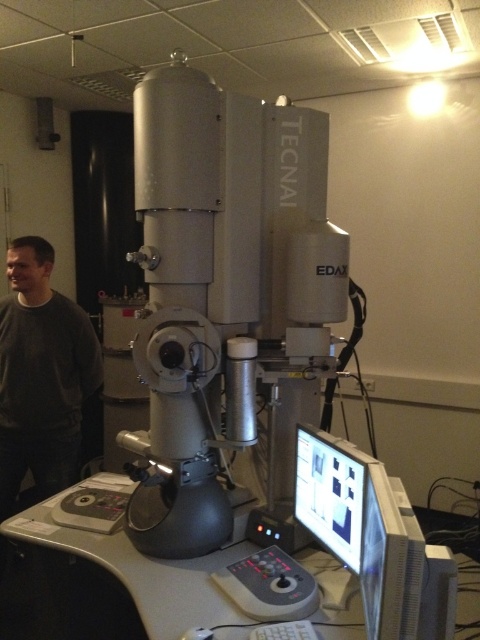
From the picture: You are a researcher in the lab and want to place a 10 cm wide sample on the gray plastic table at lower center. The lab has a rule that samples must be placed at least 5 cm away from the edge of the table. Can you determine if the sample will fit on the table?

The position of gray plastic table at lower center is at point [108,586]. However, without knowing the table dimensions, it is impossible to determine if the sample will fit. Please provide more information about the table size.

You are a researcher in the lab and need to place a small sample container on the gray plastic table at lower center and the white plastic monitor at lower right. Which object allows placing the container without obstructing the monitor screen?

The gray plastic table at lower center is positioned on the left side of the white plastic monitor at lower right, so placing the container on the gray plastic table at lower center would not obstruct the monitor screen.

You are a researcher who needs to place a 1.2 meter wide equipment on the gray plastic table at lower center. Can the equipment fit on the table? Please consider the dark gray sweater at left in your analysis.

The gray plastic table at lower center is wider than the dark gray sweater at left. However, since the sweater is not mentioned to block the table, the equipment might fit if the table is wide enough. But without exact measurements, we can only confirm the table is wider than the sweater, not the equipment.